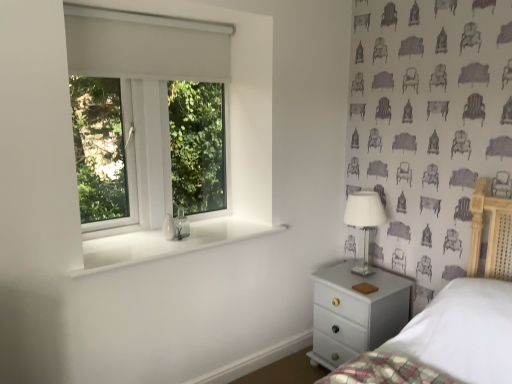
Question: Is point (125, 263) closer or farther from the camera than point (221, 233)?

Choices:
 (A) closer
 (B) farther

Answer: (A)

Question: From a real-world perspective, is white glossy window sill at lower left positioned above or below white plastic window at upper left?

Choices:
 (A) above
 (B) below

Answer: (B)

Question: Considering the real-world distances, which object is farthest from the white glossy chest of drawers at lower right?

Choices:
 (A) white glossy window sill at lower left
 (B) white plastic window at upper left
 (C) white glass table lamp at right

Answer: (B)

Question: Considering the real-world distances, which object is closest to the white glass table lamp at right?

Choices:
 (A) white plastic window at upper left
 (B) white glossy window sill at lower left
 (C) white glossy chest of drawers at lower right

Answer: (C)